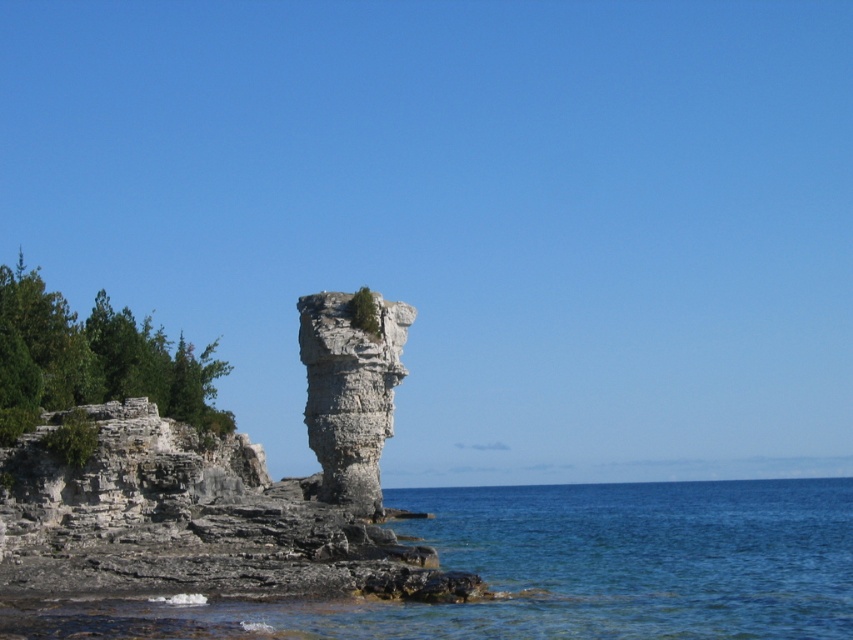
Is point (798, 621) positioned before point (171, 396)?

Yes, it is in front of point (171, 396).

Does clear blue water at lower center appear on the right side of green leafy tree at left?

Correct, you'll find clear blue water at lower center to the right of green leafy tree at left.

What do you see at coordinates (595, 564) in the screenshot?
I see `clear blue water at lower center` at bounding box center [595, 564].

Find the location of a particular element. The image size is (853, 640). clear blue water at lower center is located at coordinates (595, 564).

Measure the distance between green leafy tree at left and camera.

green leafy tree at left is 253.55 feet away from camera.

What do you see at coordinates (93, 358) in the screenshot? The height and width of the screenshot is (640, 853). I see `green leafy tree at left` at bounding box center [93, 358].

Is point (50, 387) less distant than point (339, 468)?

Yes, it is in front of point (339, 468).

Image resolution: width=853 pixels, height=640 pixels. What are the coordinates of `green leafy tree at left` in the screenshot? It's located at (93, 358).

Is clear blue water at lower center further to camera compared to gray stone column at center?

That is False.

The width and height of the screenshot is (853, 640). Describe the element at coordinates (595, 564) in the screenshot. I see `clear blue water at lower center` at that location.

Where is `clear blue water at lower center`? This screenshot has width=853, height=640. clear blue water at lower center is located at coordinates (595, 564).